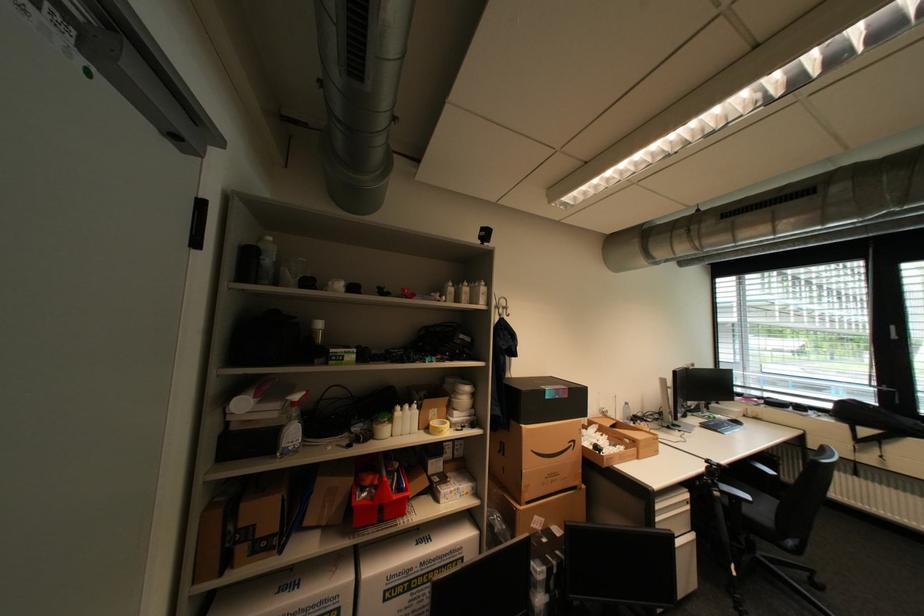
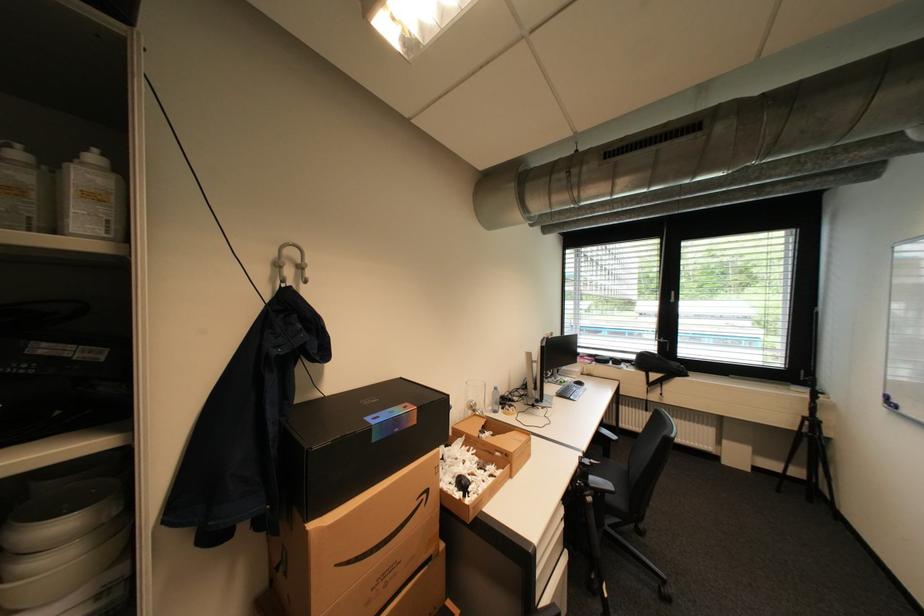
In the second image, find the point that corresponds to pixel 492 294 in the first image.

(100, 197)